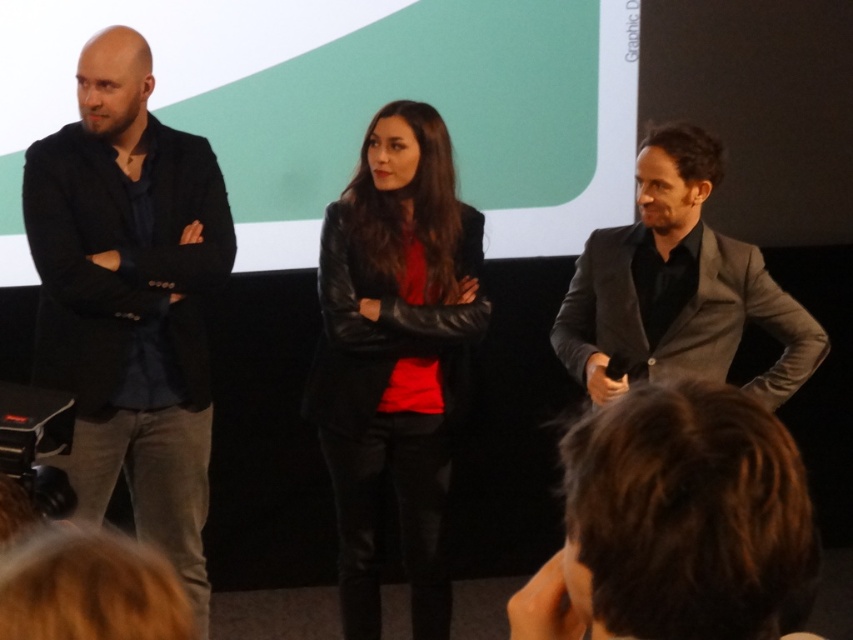
You are a photographer setting up for a group photo. You have to position a spotlight so that it can equally illuminate both the black leather jacket at left and the leather jacket at center. Given their heights, which jacket should you adjust the spotlight height to focus on to ensure both are properly lit?

The black leather jacket at left is taller than the leather jacket at center. To ensure both are properly lit, adjust the spotlight height to focus on the black leather jacket at left since it is taller, and the light will naturally cover the shorter leather jacket at center as well.